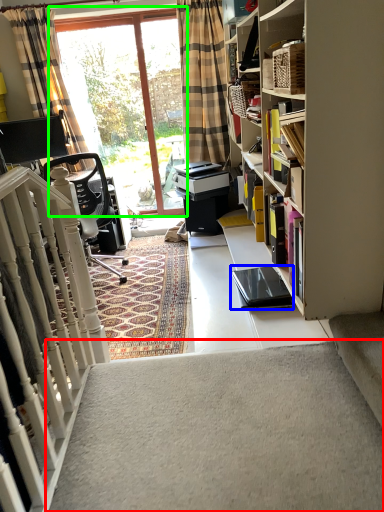
Question: Based on their relative distances, which object is nearer to stairwell (highlighted by a red box)? Choose from equipment (highlighted by a blue box) and window (highlighted by a green box).

Choices:
 (A) equipment
 (B) window

Answer: (A)